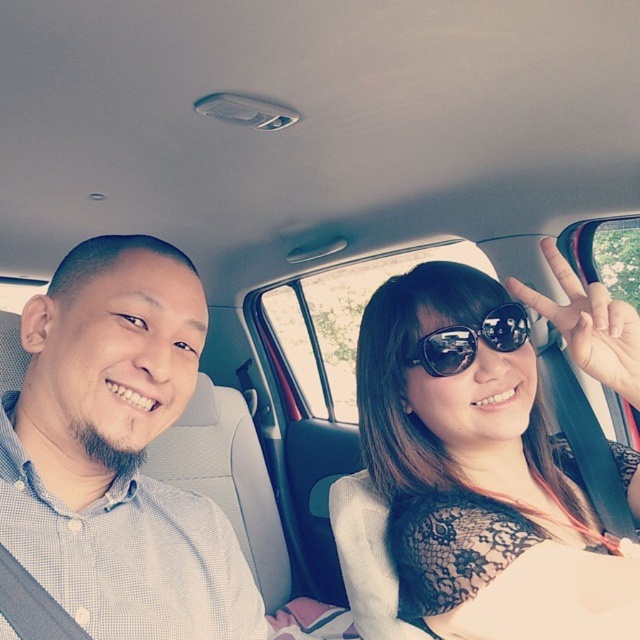
Question: Does sunglasseslace fabric at center lie behind white checkered shirt at left?

Choices:
 (A) yes
 (B) no

Answer: (A)

Question: Based on their relative distances, which object is nearer to the sunglasseslace fabric at center?

Choices:
 (A) sunglasses at center
 (B) white checkered shirt at left

Answer: (A)

Question: Which point is farther to the camera?

Choices:
 (A) sunglasses at center
 (B) white checkered shirt at left
 (C) sunglasseslace fabric at center

Answer: (A)

Question: Is white checkered shirt at left bigger than sunglasses at center?

Choices:
 (A) yes
 (B) no

Answer: (A)

Question: Which of the following is the farthest from the observer?

Choices:
 (A) sunglasses at center
 (B) sunglasseslace fabric at center
 (C) white checkered shirt at left

Answer: (A)

Question: Observing the image, what is the correct spatial positioning of sunglasseslace fabric at center in reference to sunglasses at center?

Choices:
 (A) above
 (B) below

Answer: (B)